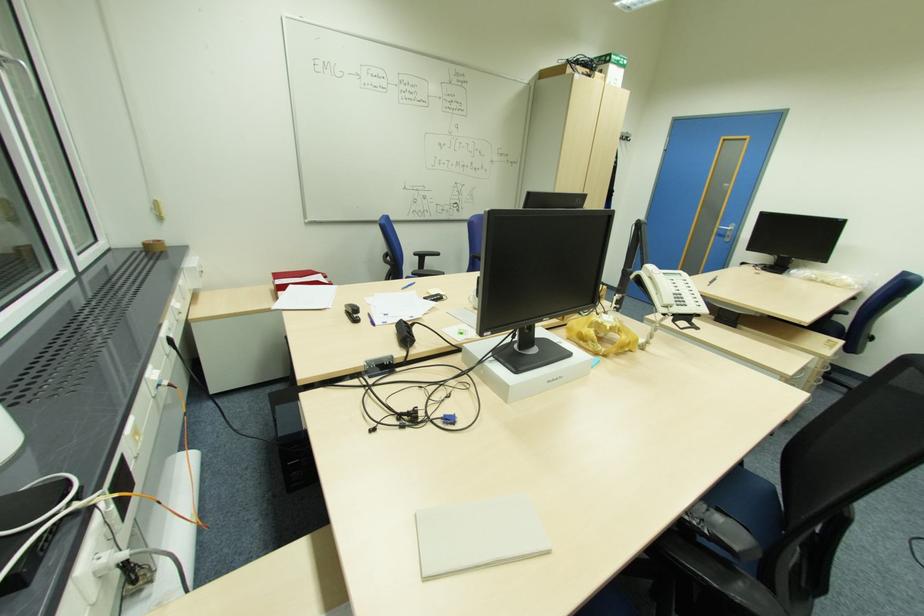
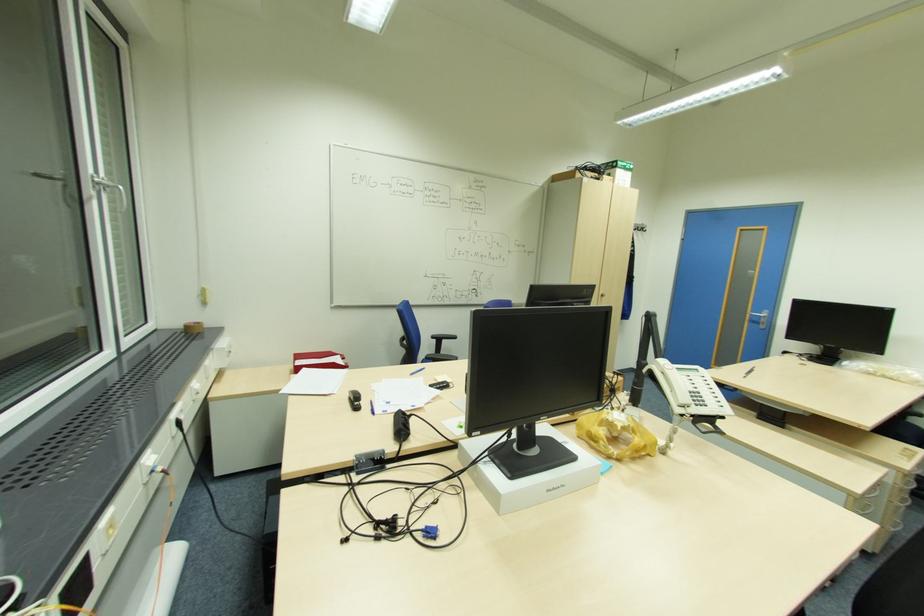
In the second image, find the point that corresponds to point 418,254 in the first image.

(435, 337)